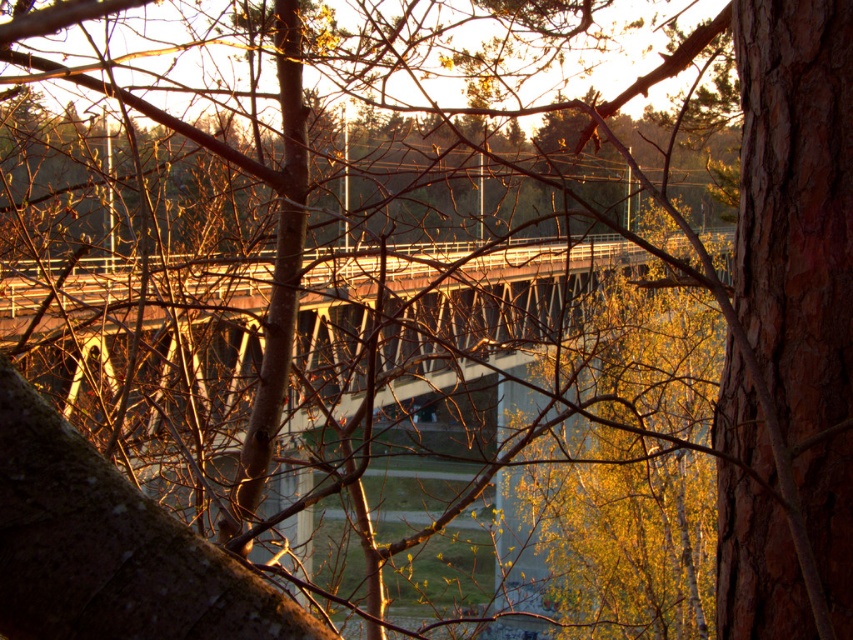
Based on the coordinates provided, where is the rusty metal bridge at center located in the image?

The rusty metal bridge at center is located at point coordinates of 0.495 on the x axis and 0.510 on the y axis.

Consider the image. You are a painter setting up an easel to paint the rusty metal bridge at center and the brown rough bark at center right. You want to ensure your canvas can fit both subjects without overcrowding. Based on their widths, which subject should you focus on first to leave enough space for the other?

The rusty metal bridge at center might be wider than brown rough bark at center right, so you should focus on painting the rusty metal bridge at center first to leave enough space for the brown rough bark at center right.